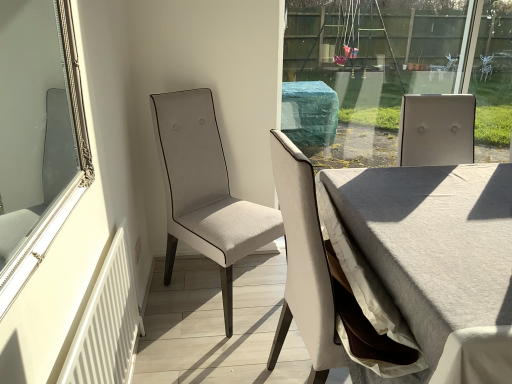
Question: From the image's perspective, is silver/golden mirror at left under white fabric chair at center, positioned as the first chair in back-to-front order?

Choices:
 (A) yes
 (B) no

Answer: (B)

Question: Does silver/golden mirror at left have a smaller size compared to white fabric chair at center, the second chair from the front?

Choices:
 (A) no
 (B) yes

Answer: (B)

Question: Does silver/golden mirror at left contain white fabric chair at center, the second chair from the front?

Choices:
 (A) no
 (B) yes

Answer: (A)

Question: Is white fabric chair at center, the second chair from the front, at the back of silver/golden mirror at left?

Choices:
 (A) no
 (B) yes

Answer: (A)

Question: Are silver/golden mirror at left and white fabric chair at center, positioned as the first chair in back-to-front order, located far from each other?

Choices:
 (A) no
 (B) yes

Answer: (A)

Question: From the image's perspective, is silver/golden mirror at left positioned above or below light gray fabric table at center?

Choices:
 (A) below
 (B) above

Answer: (B)

Question: From a real-world perspective, relative to light gray fabric table at center, is silver/golden mirror at left vertically above or below?

Choices:
 (A) below
 (B) above

Answer: (B)

Question: Based on their sizes in the image, would you say silver/golden mirror at left is bigger or smaller than light gray fabric table at center?

Choices:
 (A) small
 (B) big

Answer: (A)

Question: Is point (59, 11) closer or farther from the camera than point (386, 321)?

Choices:
 (A) closer
 (B) farther

Answer: (A)

Question: In terms of height, does white fabric chair at center, the second chair from the front, look taller or shorter compared to white textured radiator at lower left?

Choices:
 (A) tall
 (B) short

Answer: (A)

Question: Is white fabric chair at center, the second chair from the front, in front of or behind white textured radiator at lower left in the image?

Choices:
 (A) front
 (B) behind

Answer: (B)

Question: Based on their positions, is white fabric chair at center, the second chair from the front, located to the left or right of white textured radiator at lower left?

Choices:
 (A) right
 (B) left

Answer: (A)

Question: From the image's perspective, is white fabric chair at center, positioned as the first chair in back-to-front order, above or below white textured radiator at lower left?

Choices:
 (A) above
 (B) below

Answer: (A)

Question: From the image's perspective, is white fabric chair at center, positioned as the first chair in back-to-front order, located above or below light beige fabric chair at center, which appears as the 1th chair when viewed from the front?

Choices:
 (A) above
 (B) below

Answer: (A)

Question: Considering their positions, is white fabric chair at center, the second chair from the front, located in front of or behind light beige fabric chair at center, which appears as the 1th chair when viewed from the front?

Choices:
 (A) front
 (B) behind

Answer: (B)